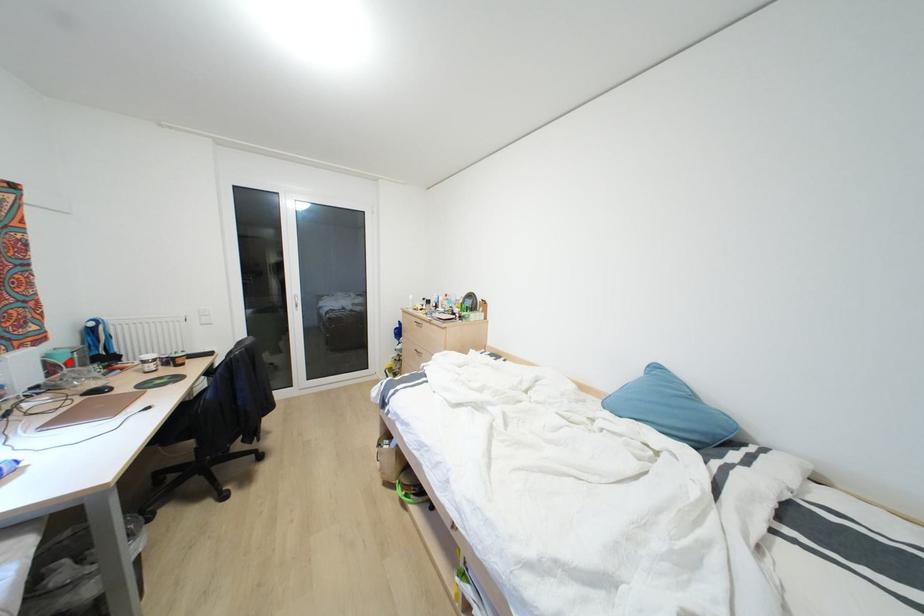
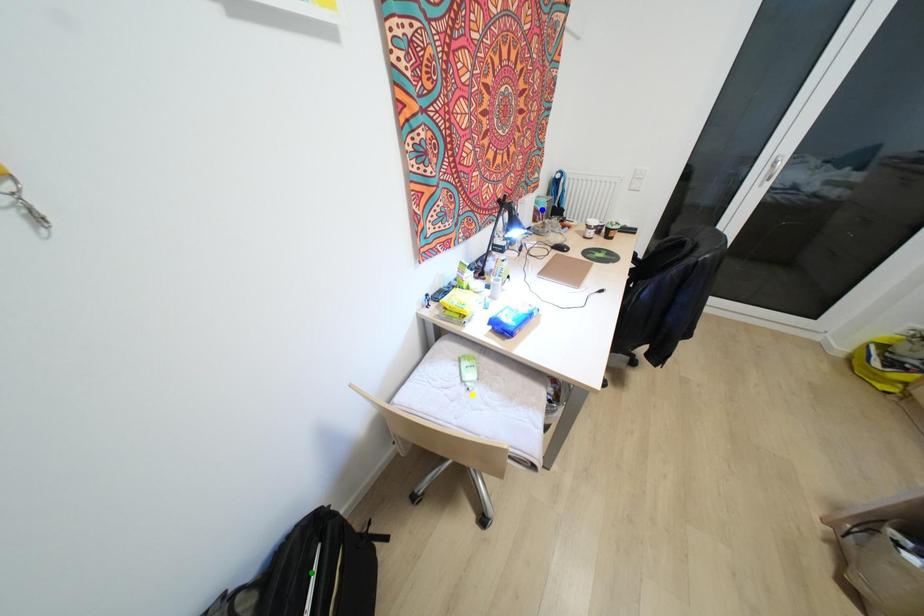
Question: I am providing you with two images of the same scene from different viewpoints. A red point is marked on the first image. You are given multiple points on the second image. Which mark in image 2 goes with the point in image 1?

Choices:
 (A) green point
 (B) blue point
 (C) yellow point

Answer: (B)